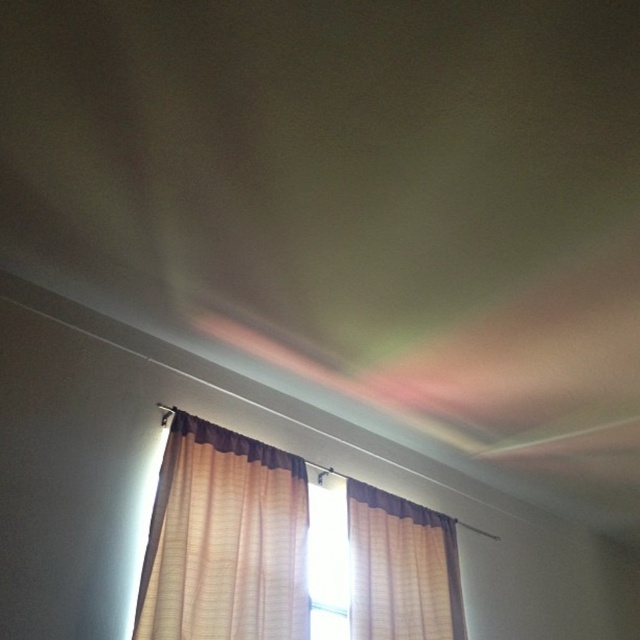
Which is more to the right, beige fabric curtain at lower left or transparent glass window at center?

Positioned to the right is transparent glass window at center.

Does beige fabric curtain at lower left have a greater height compared to transparent glass window at center?

Correct, beige fabric curtain at lower left is much taller as transparent glass window at center.

Where is `beige fabric curtain at lower left`? The width and height of the screenshot is (640, 640). beige fabric curtain at lower left is located at coordinates (225, 540).

This screenshot has width=640, height=640. I want to click on beige fabric curtain at lower left, so click(225, 540).

Between beige fabric curtain at lower left and beige textured curtain at upper right, which one appears on the right side from the viewer's perspective?

Positioned to the right is beige textured curtain at upper right.

Does beige fabric curtain at lower left lie in front of beige textured curtain at upper right?

Yes, beige fabric curtain at lower left is closer to the viewer.

Which is in front, point (276, 467) or point (452, 564)?

Point (276, 467) is more forward.

Where is `beige fabric curtain at lower left`? The height and width of the screenshot is (640, 640). beige fabric curtain at lower left is located at coordinates (225, 540).

Can you confirm if beige textured curtain at upper right is positioned to the right of transparent glass window at center?

Correct, you'll find beige textured curtain at upper right to the right of transparent glass window at center.

Which is below, beige textured curtain at upper right or transparent glass window at center?

beige textured curtain at upper right is lower down.

The height and width of the screenshot is (640, 640). What are the coordinates of `beige textured curtain at upper right` in the screenshot? It's located at (401, 568).